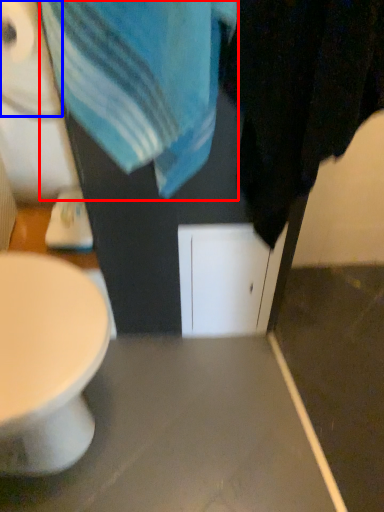
Question: Which object appears farthest to the camera in this image, beach towel (highlighted by a red box) or toilet paper (highlighted by a blue box)?

Choices:
 (A) beach towel
 (B) toilet paper

Answer: (B)